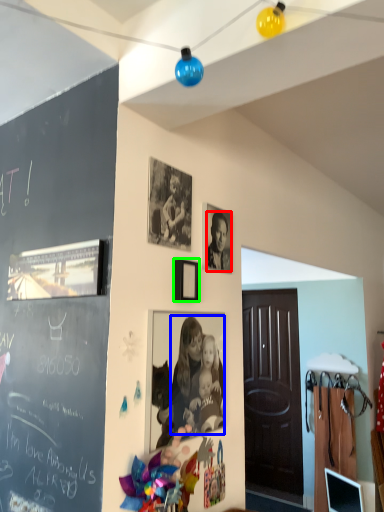
Question: Estimate the real-world distances between objects in this image. Which object is closer to person (highlighted by a red box), person (highlighted by a blue box) or picture frame (highlighted by a green box)?

Choices:
 (A) person
 (B) picture frame

Answer: (B)